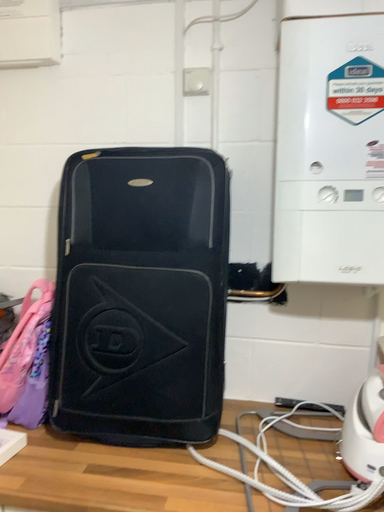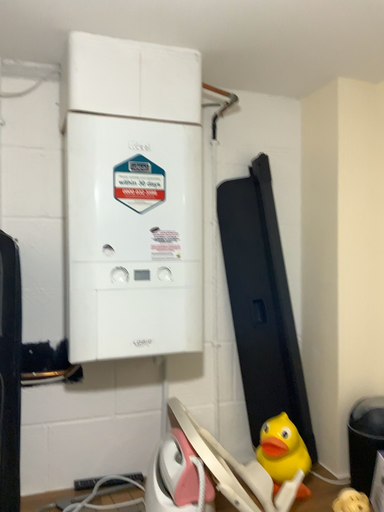
Question: Which way did the camera rotate in the video?

Choices:
 (A) rotated upward
 (B) rotated downward

Answer: (A)